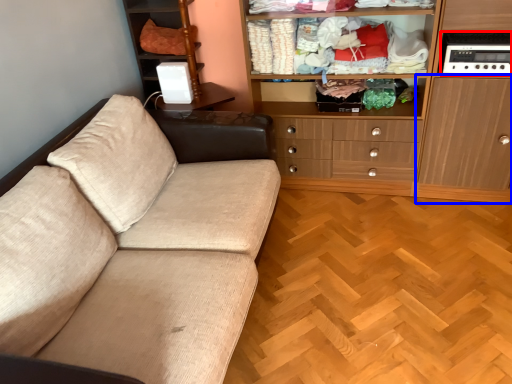
Question: Which point is closer to the camera, appliance (highlighted by a red box) or cabinetry (highlighted by a blue box)?

Choices:
 (A) appliance
 (B) cabinetry

Answer: (B)